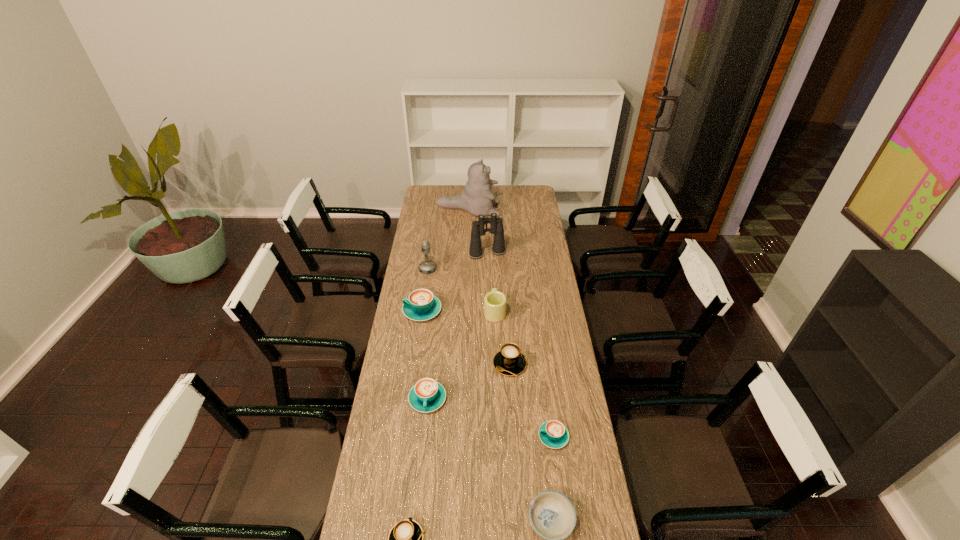
The height and width of the screenshot is (540, 960). I want to click on free space that satisfies the following two spatial constraints: 1. on the front side of the second tallest object; 2. on the left side of the second farthest cappuccino, so click(x=490, y=364).